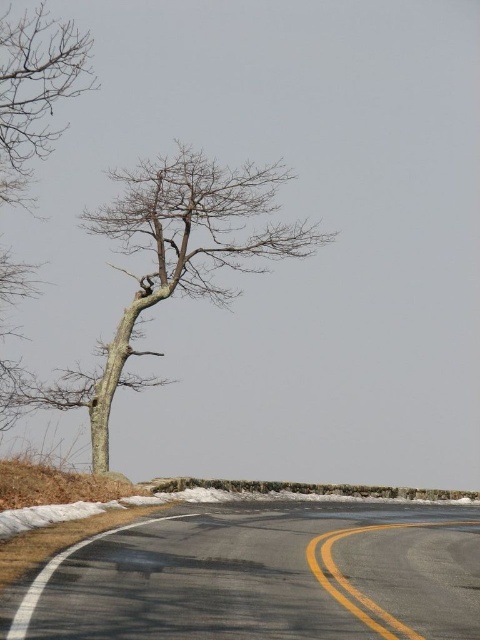
You are a pedestrian standing on the yellow asphalt at lower center. Looking up, you notice the bare branches at upper left. Can you determine if the branches are taller than your current position?

The bare branches at upper left are taller than the yellow asphalt at lower center, so yes, the branches are taller than your current position on the yellow asphalt at lower center.

You are a painter standing on the roadside, wanting to capture the scene. You notice the bark textured tree at center and the yellow asphalt at lower center. Which object appears narrower in your painting?

The bark textured tree at center appears narrower than the yellow asphalt at lower center because it has a lesser width compared to it.